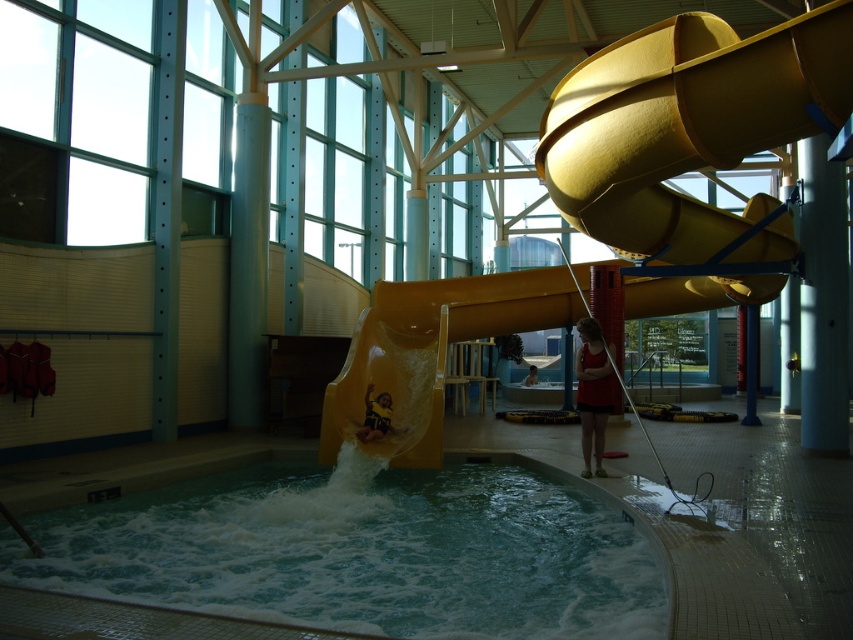
You are a maintenance worker who needs to clean the clear glass swimming pool at lower center and the dark blue fabric at center. You have a 10 foot long cleaning tool. Can you reach both objects without moving the tool? Explain your reasoning.

The clear glass swimming pool at lower center and the dark blue fabric at center are 8.37 feet apart. Since the cleaning tool is 10 feet long, which is longer than the distance between them, you can reach both objects without moving the tool.

You are standing in the indoor water park and want to jump into the clear glass swimming pool at lower center. If your maximum comfortable jumping distance is 6 meters, can you safely jump into it from where you are?

The clear glass swimming pool at lower center is 6.14 meters away from the viewer. Since your maximum comfortable jumping distance is 6 meters, you cannot safely jump into it from your current position as the distance exceeds your comfort level.

You are standing in the indoor water park and want to take a photo of the water slide. You notice two points marked on the slide at coordinates point (668, 292) and point (376, 419). Which point should you focus on to ensure it appears closer in your photo?

You should focus on point (668, 292) because it is further to the camera than point (376, 419), making it appear closer in the photo.